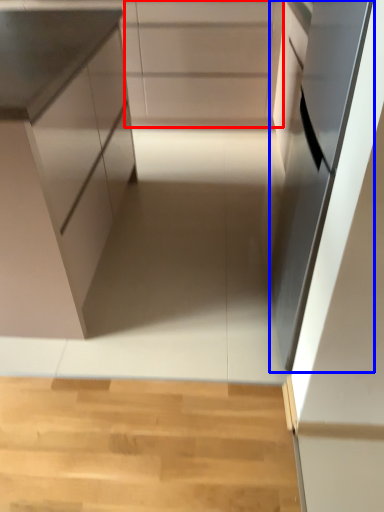
Question: Which object appears farthest to the camera in this image, cabinetry (highlighted by a red box) or oven (highlighted by a blue box)?

Choices:
 (A) cabinetry
 (B) oven

Answer: (A)